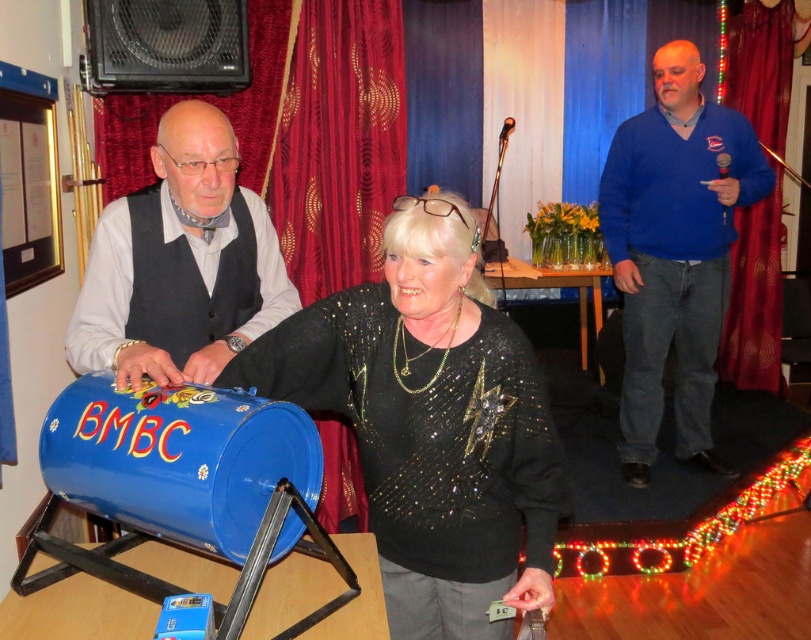
Question: From the image, what is the correct spatial relationship of sparkly black sweater at center in relation to brushed metal drum at left?

Choices:
 (A) above
 (B) below

Answer: (B)

Question: Is sparkly black sweater at center to the left of blue sweater at right from the viewer's perspective?

Choices:
 (A) no
 (B) yes

Answer: (B)

Question: Which of the following is the closest to the observer?

Choices:
 (A) (683, 182)
 (B) (187, 241)

Answer: (B)

Question: Can you confirm if sparkly black sweater at center is bigger than brushed metal drum at left?

Choices:
 (A) no
 (B) yes

Answer: (B)

Question: Among these points, which one is nearest to the camera?

Choices:
 (A) (194, 163)
 (B) (470, 621)
 (C) (659, 132)

Answer: (B)

Question: Which point is closer to the camera?

Choices:
 (A) (707, 323)
 (B) (217, 348)

Answer: (B)